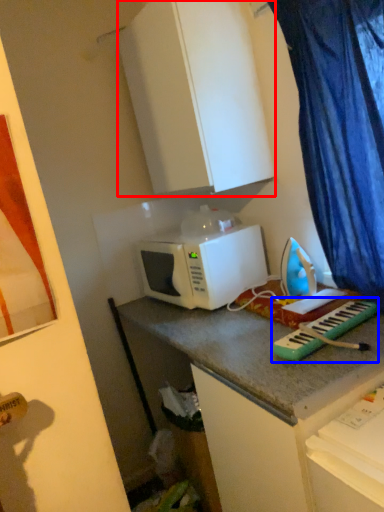
Question: Which point is closer to the camera, cabinetry (highlighted by a red box) or musical keyboard (highlighted by a blue box)?

Choices:
 (A) cabinetry
 (B) musical keyboard

Answer: (B)